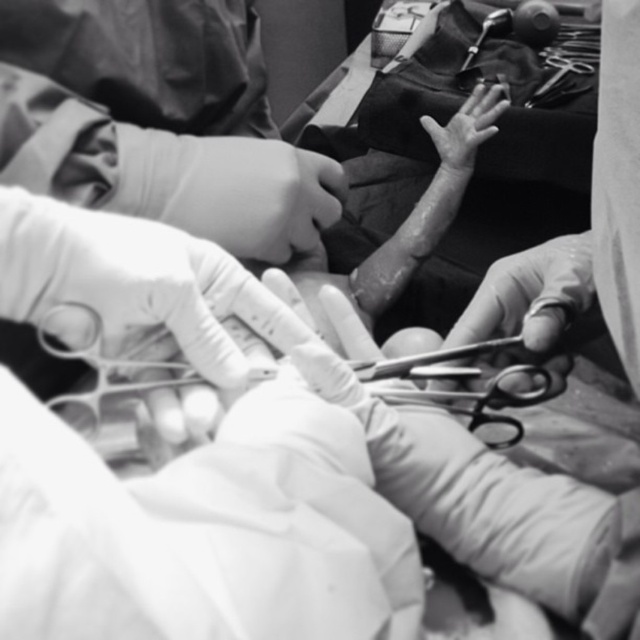
Which is below, smooth rubber glove at center or smooth skin hand at center?

smooth rubber glove at center

Is point (268, 225) closer to viewer compared to point (472, 140)?

That is True.

You are a GUI agent. You are given a task and a screenshot of the screen. Output one action in this format:
    pyautogui.click(x=<x>, y=<y>)
    Task: Click on the smooth rubber glove at center
    Image resolution: width=640 pixels, height=640 pixels.
    Given the screenshot: What is the action you would take?
    pyautogui.click(x=253, y=195)

Measure the distance from smooth metal scissors at center to smooth skin hand at center.

smooth metal scissors at center and smooth skin hand at center are 12.72 inches apart.

What do you see at coordinates (531, 294) in the screenshot? I see `smooth metal scissors at center` at bounding box center [531, 294].

You are a GUI agent. You are given a task and a screenshot of the screen. Output one action in this format:
    pyautogui.click(x=<x>, y=<y>)
    Task: Click on the smooth metal scissors at center
    This screenshot has height=640, width=640.
    Given the screenshot: What is the action you would take?
    pyautogui.click(x=531, y=294)

Does smooth rubber glove at center appear on the right side of smooth metal scissors at center?

In fact, smooth rubber glove at center is to the left of smooth metal scissors at center.

Where is `smooth rubber glove at center`? The width and height of the screenshot is (640, 640). smooth rubber glove at center is located at coordinates (253, 195).